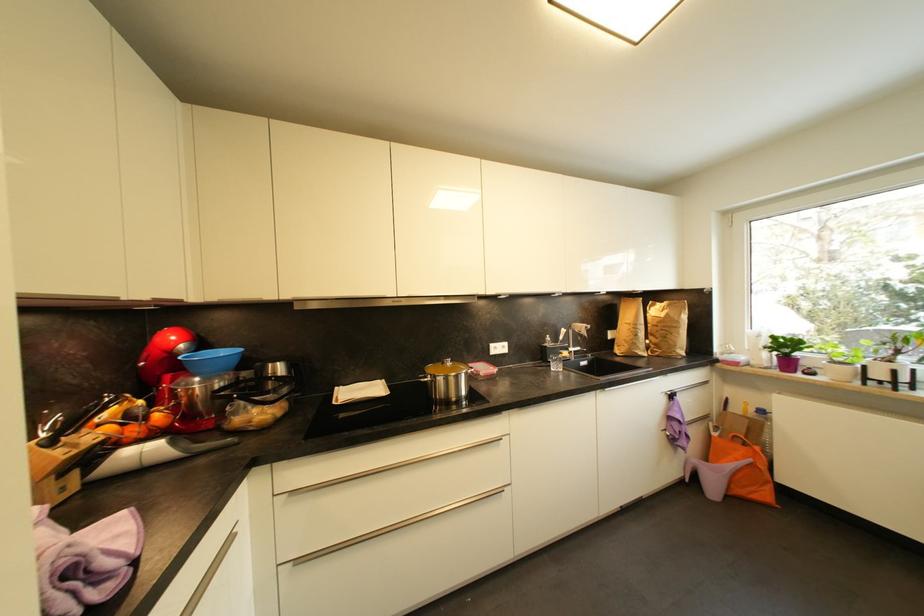
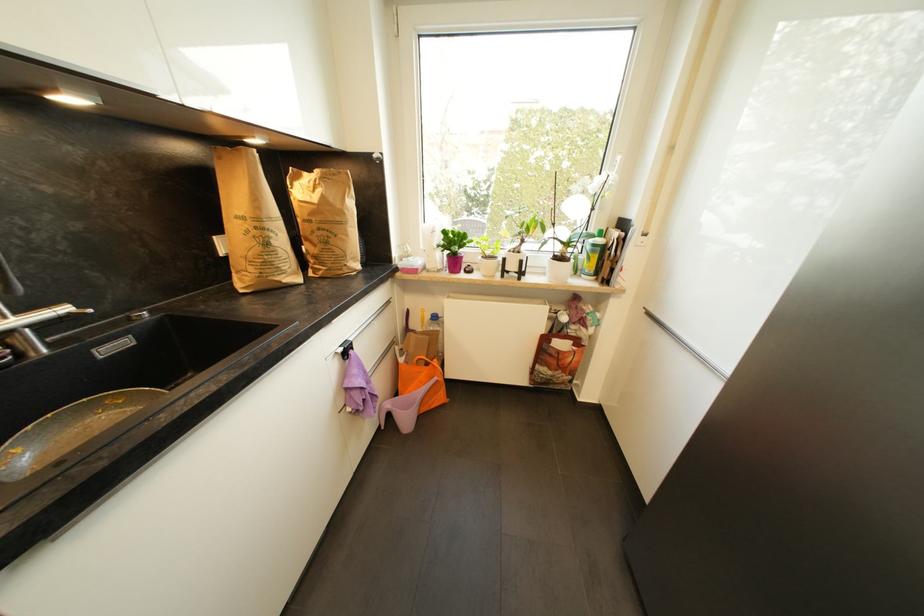
In the second image, find the point that corresponds to pixel 777 339 in the first image.

(450, 233)